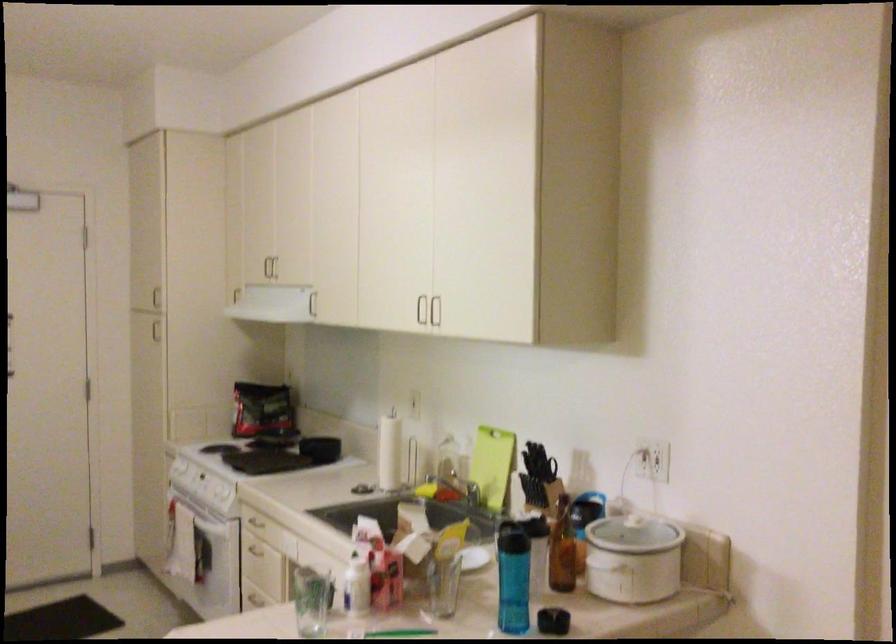
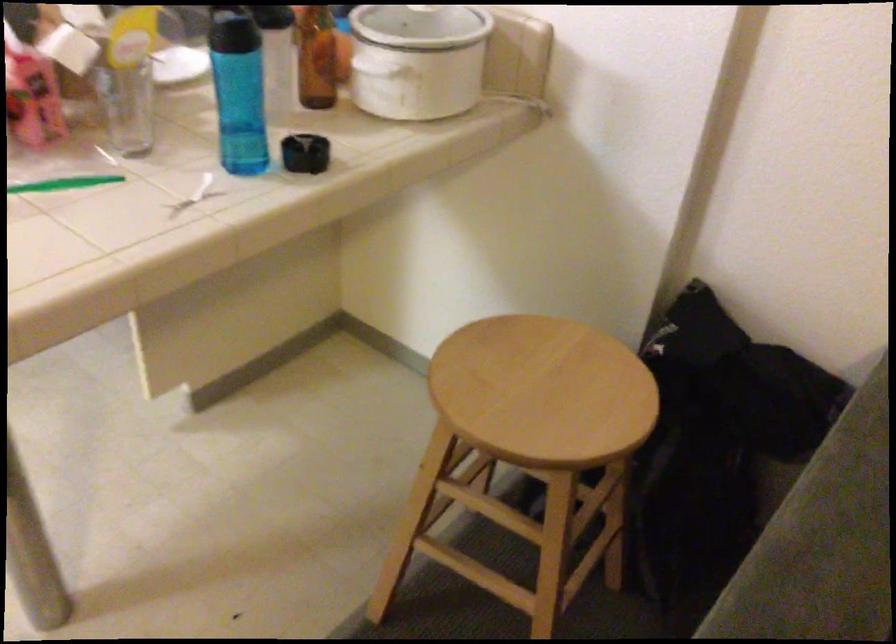
Locate, in the second image, the point that corresponds to pixel 638 558 in the first image.

(418, 60)